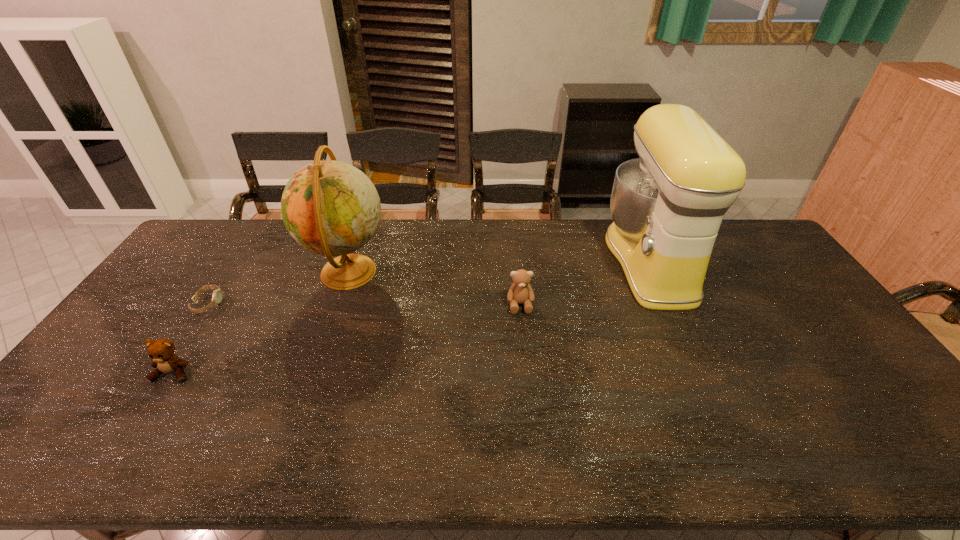
Where is `vacant space situated 0.320m on the front of the third object from left to right`? The width and height of the screenshot is (960, 540). vacant space situated 0.320m on the front of the third object from left to right is located at coordinates (303, 403).

Locate an element on the screen. The width and height of the screenshot is (960, 540). free space located on the front-facing side of the farther teddy bear is located at coordinates (531, 416).

Locate an element on the screen. Image resolution: width=960 pixels, height=540 pixels. vacant space located on the front-facing side of the nearest object is located at coordinates (151, 408).

Locate an element on the screen. Image resolution: width=960 pixels, height=540 pixels. blank area located on the face of the watch is located at coordinates (270, 303).

Find the location of a particular element. mixer present at the far edge is located at coordinates (667, 206).

This screenshot has height=540, width=960. Identify the location of globe that is at the far edge. (331, 208).

I want to click on object present at the left edge, so click(217, 294).

The image size is (960, 540). I want to click on free spot at the far edge of the desktop, so click(388, 224).

In the image, there is a desktop. Identify the location of vacant space at the near edge. The width and height of the screenshot is (960, 540). (395, 455).

Identify the location of vacant area at the right edge of the desktop. The width and height of the screenshot is (960, 540). (821, 353).